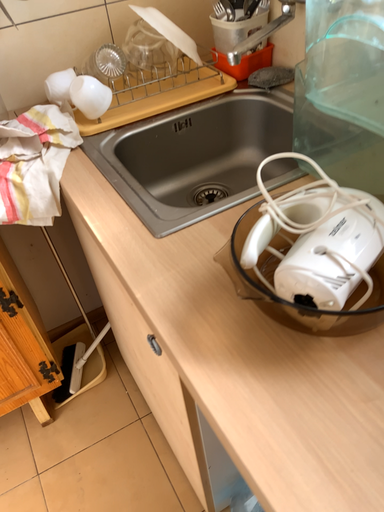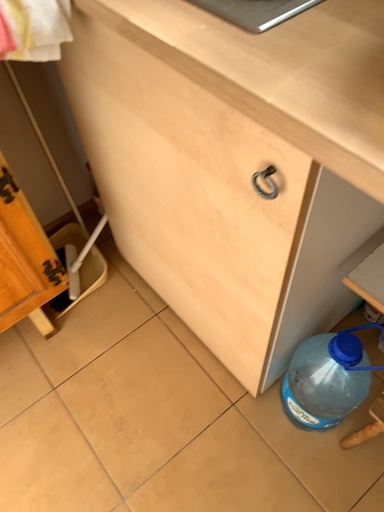
Question: How did the camera likely rotate when shooting the video?

Choices:
 (A) rotated right
 (B) rotated left

Answer: (A)